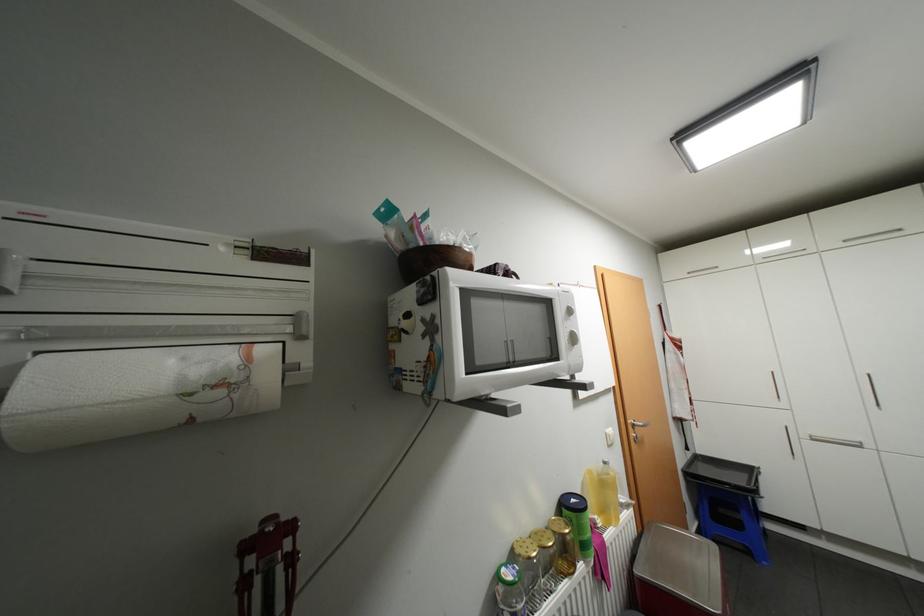
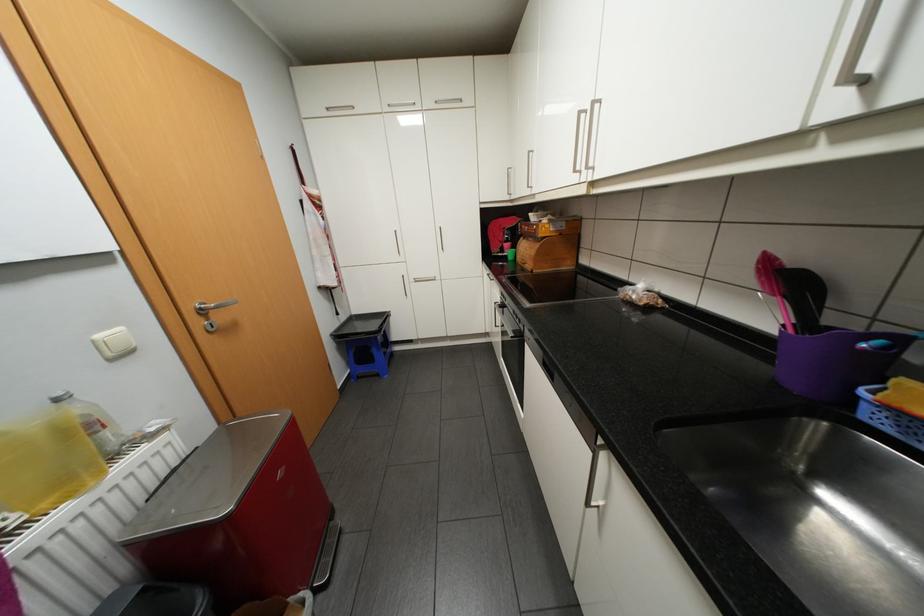
First-person continuous shooting, in which direction is the camera rotating?

The rotation direction of the camera is right-down.